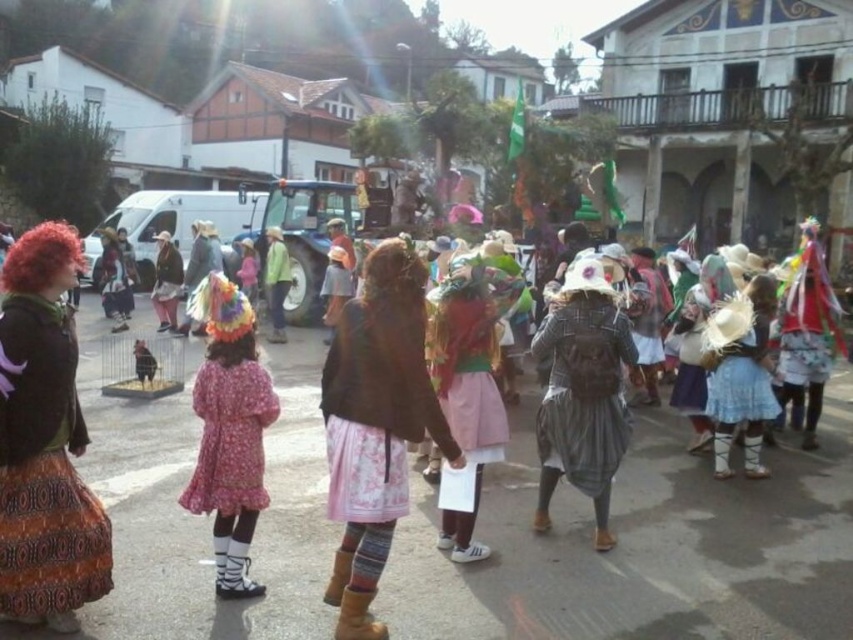
Question: Which of these objects is positioned farthest from the multicolored fabric dress at right?

Choices:
 (A) matte pink dress at center
 (B) green matte jacket at center
 (C) floral fabric dress at center
 (D) floral-patterned skirt at center

Answer: (A)

Question: Can you confirm if floral-patterned skirt at center is positioned above blue cotton dress at right?

Choices:
 (A) yes
 (B) no

Answer: (B)

Question: Can you confirm if printed fabric skirt at left is positioned below multicolored fabric dress at right?

Choices:
 (A) yes
 (B) no

Answer: (A)

Question: Which point is closer to the camera?

Choices:
 (A) printed fabric skirt at left
 (B) green matte jacket at center
 (C) matte pink dress at center

Answer: (A)

Question: Does gray woolen coat at center appear on the right side of green matte jacket at center?

Choices:
 (A) no
 (B) yes

Answer: (B)

Question: Which is nearer to the green matte jacket at center?

Choices:
 (A) blue cotton dress at right
 (B) pink fabric dress at center
 (C) multicolored fabric dress at right

Answer: (A)